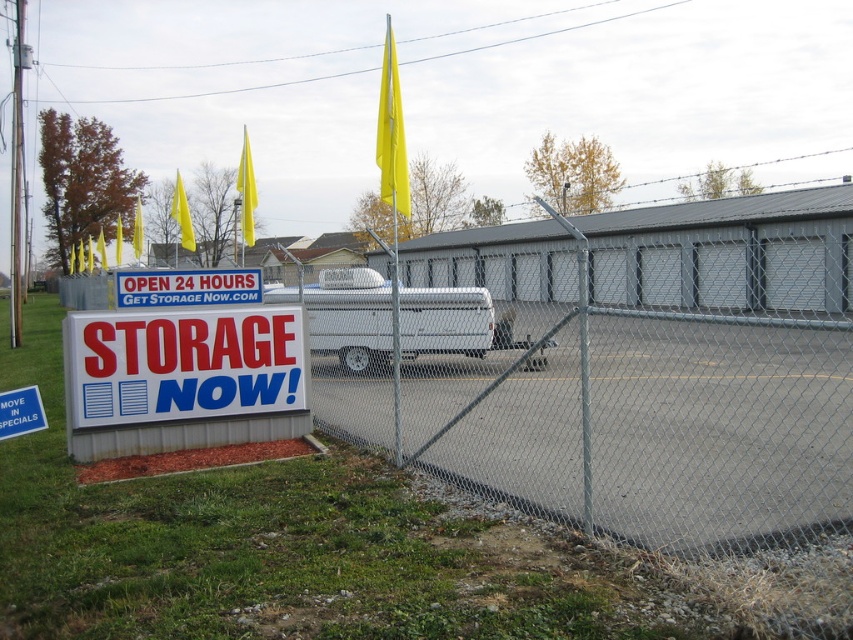
Question: Can you confirm if gray chain-link fence at center is positioned to the left of white matte van at center?

Choices:
 (A) no
 (B) yes

Answer: (A)

Question: Which object is positioned closest to the gray chain-link fence at center?

Choices:
 (A) white plastic sign at center
 (B) white plastic sign at lower left
 (C) white matte van at center

Answer: (B)

Question: Based on their relative distances, which object is farther from the white matte van at center?

Choices:
 (A) white plastic sign at lower left
 (B) gray chain-link fence at center
 (C) white plastic sign at center

Answer: (B)

Question: Is the position of gray chain-link fence at center more distant than that of white plastic sign at center?

Choices:
 (A) yes
 (B) no

Answer: (B)

Question: Estimate the real-world distances between objects in this image. Which object is closer to the gray chain-link fence at center?

Choices:
 (A) white plastic sign at center
 (B) white plastic sign at lower left

Answer: (B)

Question: Is white plastic sign at lower left above white matte van at center?

Choices:
 (A) no
 (B) yes

Answer: (A)